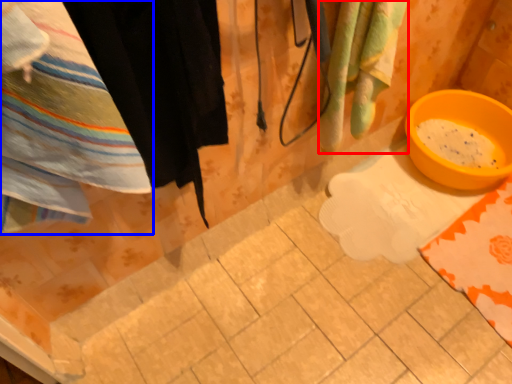
Question: Among these objects, which one is farthest to the camera, beach towel (highlighted by a red box) or towel (highlighted by a blue box)?

Choices:
 (A) beach towel
 (B) towel

Answer: (A)